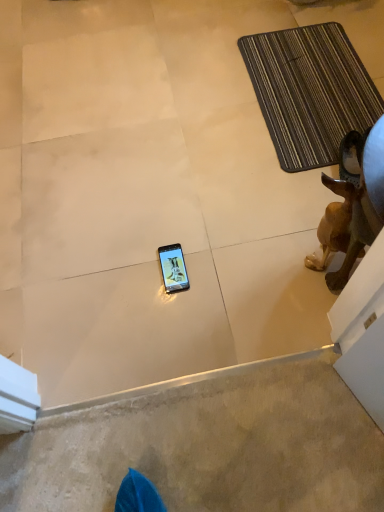
Question: Does brown striped bath mat at upper right have a greater width compared to smooth beige carpet at lower center?

Choices:
 (A) yes
 (B) no

Answer: (A)

Question: Does brown striped bath mat at upper right come in front of smooth beige carpet at lower center?

Choices:
 (A) yes
 (B) no

Answer: (B)

Question: Could you tell me if brown striped bath mat at upper right is facing smooth beige carpet at lower center?

Choices:
 (A) yes
 (B) no

Answer: (B)

Question: From a real-world perspective, is brown striped bath mat at upper right located beneath smooth beige carpet at lower center?

Choices:
 (A) yes
 (B) no

Answer: (B)

Question: From a real-world perspective, is brown striped bath mat at upper right physically above smooth beige carpet at lower center?

Choices:
 (A) yes
 (B) no

Answer: (A)

Question: Is brown striped bath mat at upper right thinner than smooth beige carpet at lower center?

Choices:
 (A) yes
 (B) no

Answer: (B)

Question: Is the position of brown matte dog at right more distant than that of smooth beige carpet at lower center?

Choices:
 (A) yes
 (B) no

Answer: (B)

Question: Does brown matte dog at right appear on the left side of smooth beige carpet at lower center?

Choices:
 (A) yes
 (B) no

Answer: (B)

Question: From a real-world perspective, is brown matte dog at right positioned over smooth beige carpet at lower center based on gravity?

Choices:
 (A) yes
 (B) no

Answer: (A)

Question: Does brown matte dog at right come in front of smooth beige carpet at lower center?

Choices:
 (A) no
 (B) yes

Answer: (B)

Question: Does brown matte dog at right have a lesser height compared to smooth beige carpet at lower center?

Choices:
 (A) yes
 (B) no

Answer: (B)

Question: Can you confirm if brown matte dog at right is thinner than smooth beige carpet at lower center?

Choices:
 (A) no
 (B) yes

Answer: (B)

Question: From a real-world perspective, does brown matte dog at right stand above brown striped bath mat at upper right?

Choices:
 (A) yes
 (B) no

Answer: (A)